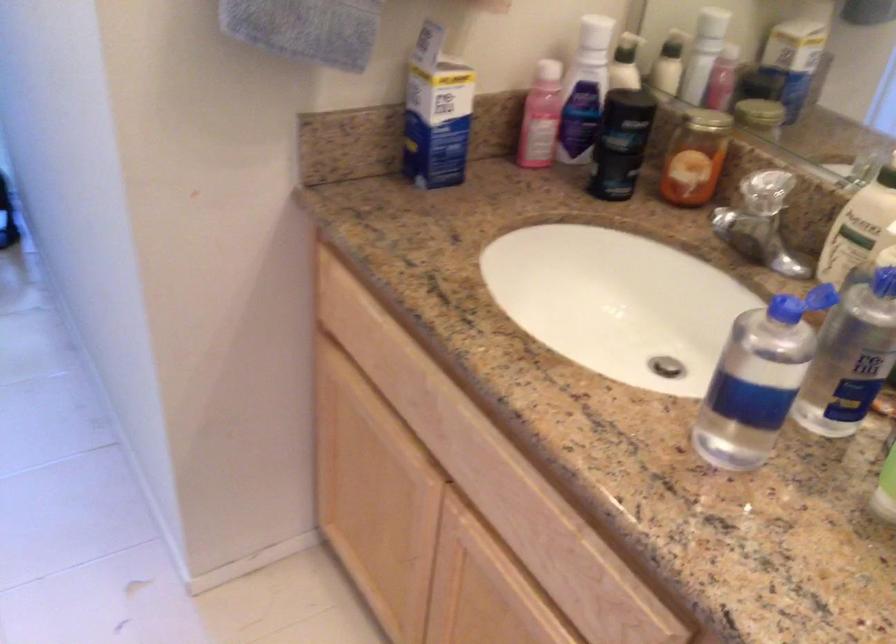
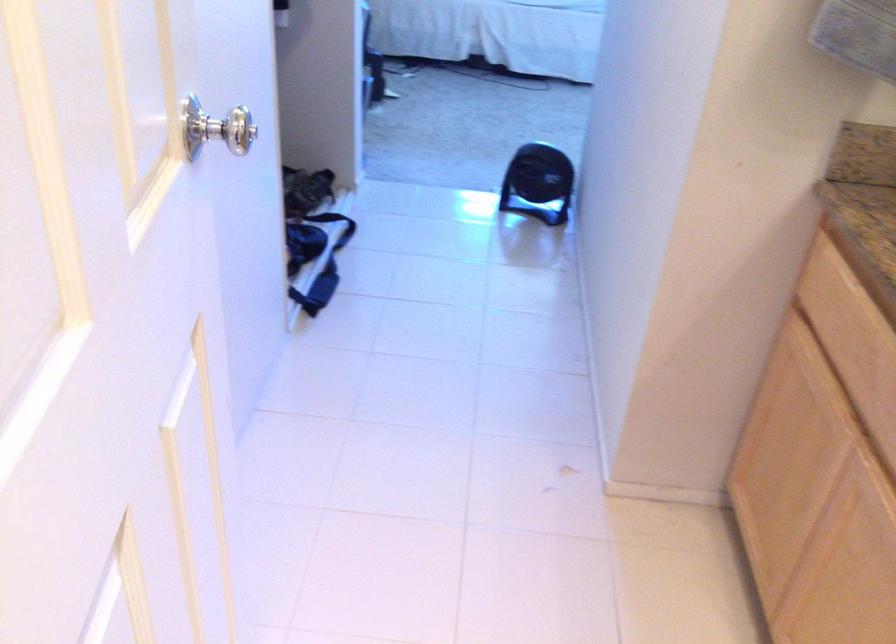
Question: The images are taken continuously from a first-person perspective. In which direction is your viewpoint rotating?

Choices:
 (A) Left
 (B) Right
 (C) Up
 (D) Down

Answer: (A)